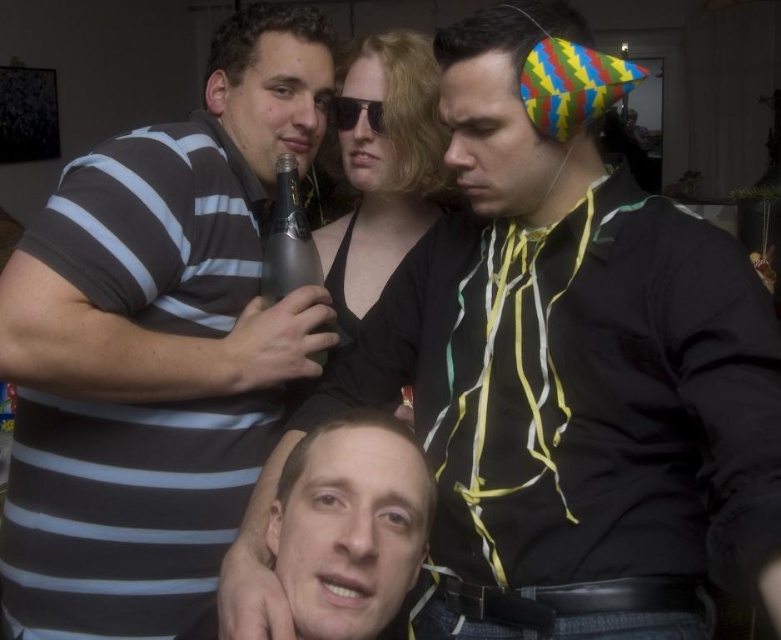
Question: Does smooth skin face at center have a smaller size compared to black plastic sunglasses at center?

Choices:
 (A) no
 (B) yes

Answer: (A)

Question: Is striped cotton shirt at upper left wider than smooth skin face at center?

Choices:
 (A) no
 (B) yes

Answer: (B)

Question: Among these points, which one is farthest from the camera?

Choices:
 (A) (95, 198)
 (B) (555, 179)
 (C) (280, 285)

Answer: (C)

Question: Considering the relative positions of smooth skin face at center and black plastic sunglasses at center in the image provided, where is smooth skin face at center located with respect to black plastic sunglasses at center?

Choices:
 (A) below
 (B) above

Answer: (A)

Question: Among these objects, which one is farthest from the camera?

Choices:
 (A) smooth skin face at center
 (B) black plastic sunglasses at center
 (C) silver metallic bottle at upper center
 (D) striped cotton shirt at left

Answer: (B)

Question: Estimate the real-world distances between objects in this image. Which object is closer to the striped cotton shirt at upper left?

Choices:
 (A) black plastic sunglasses at center
 (B) silver metallic bottle at upper center
 (C) striped cotton shirt at left
 (D) smooth skin face at center

Answer: (D)